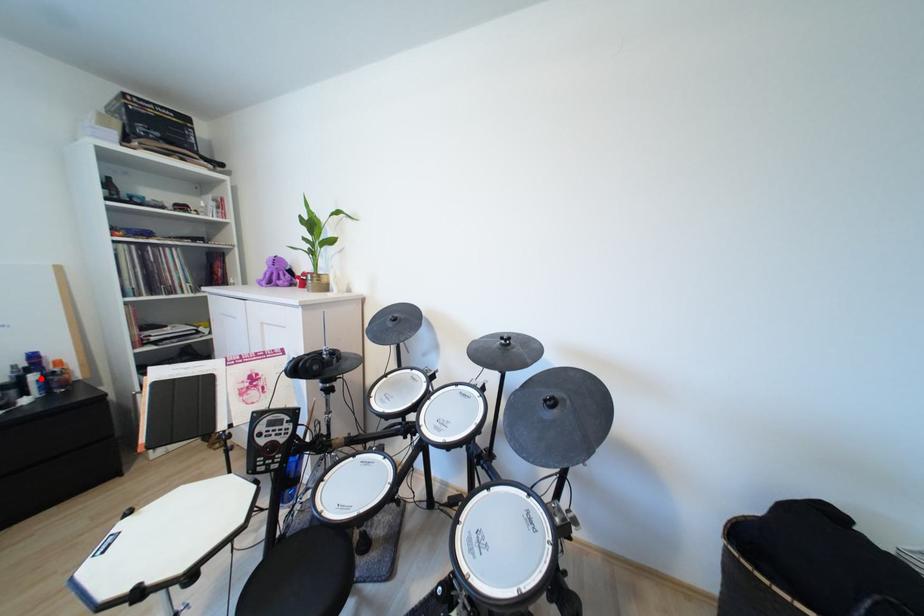
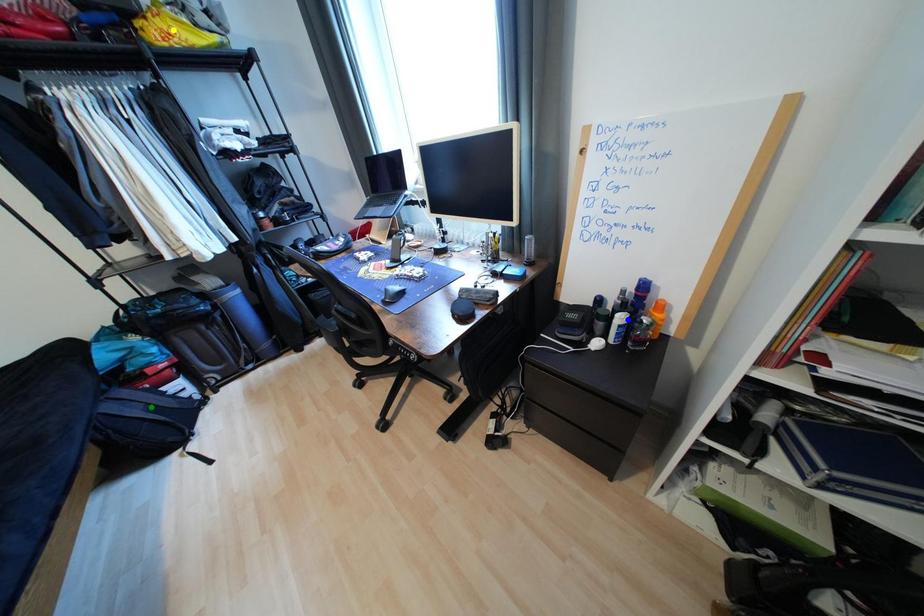
Question: I am providing you with two images of the same scene from different viewpoints. A red point is marked on the first image. You are given multiple points on the second image. Which point in image 2 is actually the same real-world point as the red point in image 1?

Choices:
 (A) blue point
 (B) yellow point
 (C) green point

Answer: (A)